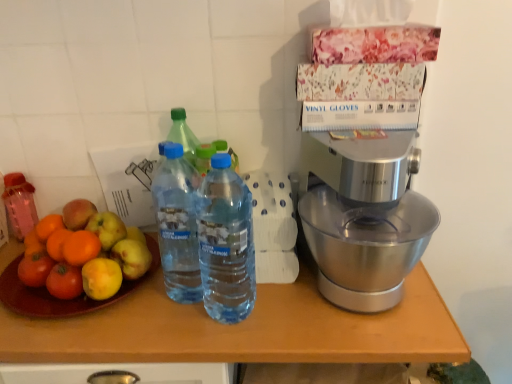
At what (x,y) coordinates should I click in order to perform the action: click on vacant space positioned to the left of transparent plastic bottle at center, placed as the first bottle when sorted from front to back. Please return your answer as a coordinate pair (x, y). Looking at the image, I should click on (156, 329).